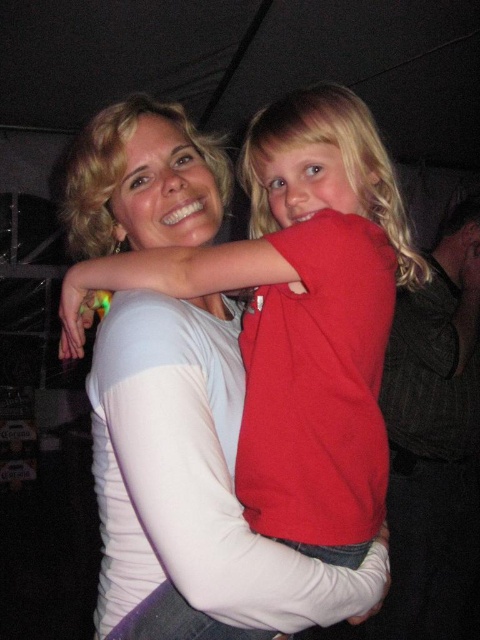
Question: Which of the following is the closest to the observer?

Choices:
 (A) (457, 563)
 (B) (291, 433)

Answer: (B)

Question: Can you confirm if red matte shirt at center is smaller than red cotton shirt at center?

Choices:
 (A) yes
 (B) no

Answer: (B)

Question: Can you confirm if red matte shirt at center is positioned to the left of red cotton shirt at center?

Choices:
 (A) no
 (B) yes

Answer: (B)

Question: Is red matte shirt at center positioned before red cotton shirt at center?

Choices:
 (A) no
 (B) yes

Answer: (B)